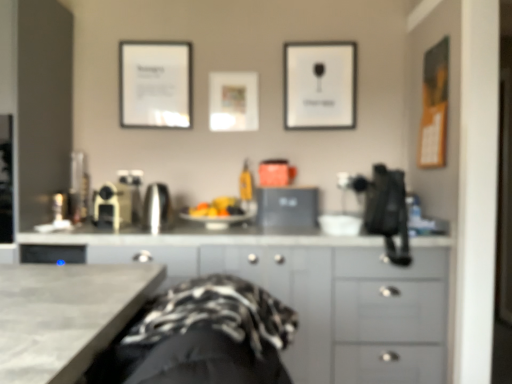
Question: Does matte white picture frame at center, marked as the 2th picture frame in a right-to-left arrangement, have a larger size compared to gray matte cabinet at center?

Choices:
 (A) yes
 (B) no

Answer: (B)

Question: Is matte white picture frame at center, which is the 2th picture frame from left to right, next to gray matte cabinet at center and touching it?

Choices:
 (A) no
 (B) yes

Answer: (A)

Question: Is matte white picture frame at center, which is the 2th picture frame from left to right, further to camera compared to gray matte cabinet at center?

Choices:
 (A) yes
 (B) no

Answer: (A)

Question: Is matte white picture frame at center, which is the 2th picture frame from left to right, to the right of gray matte cabinet at center from the viewer's perspective?

Choices:
 (A) yes
 (B) no

Answer: (B)

Question: Considering the relative sizes of matte white picture frame at center, which is the 2th picture frame from left to right, and gray matte cabinet at center in the image provided, is matte white picture frame at center, which is the 2th picture frame from left to right, shorter than gray matte cabinet at center?

Choices:
 (A) yes
 (B) no

Answer: (A)

Question: In terms of height, does white paper picture frame at upper center, the first picture frame from the right, look taller or shorter compared to white paper at upper left, marked as the third picture frame in a right-to-left arrangement?

Choices:
 (A) tall
 (B) short

Answer: (A)

Question: From a real-world perspective, is white paper picture frame at upper center, which appears as the 3th picture frame when viewed from the left, above or below white paper at upper left, which is the 1th picture frame in left-to-right order?

Choices:
 (A) above
 (B) below

Answer: (B)

Question: From the image's perspective, is white paper picture frame at upper center, the first picture frame from the right, above or below white paper at upper left, which is the 1th picture frame in left-to-right order?

Choices:
 (A) above
 (B) below

Answer: (B)

Question: Is point (284, 74) positioned closer to the camera than point (148, 99)?

Choices:
 (A) farther
 (B) closer

Answer: (B)

Question: Looking at their shapes, would you say satin black laptop at center, which appears as the third appliance when viewed from the left, is wider or thinner than white paper picture frame at upper center, the first picture frame from the right?

Choices:
 (A) thin
 (B) wide

Answer: (B)

Question: In the image, is satin black laptop at center, the first appliance in the right-to-left sequence, positioned in front of or behind white paper picture frame at upper center, the first picture frame from the right?

Choices:
 (A) front
 (B) behind

Answer: (A)

Question: Do you think satin black laptop at center, the first appliance in the right-to-left sequence, is within white paper picture frame at upper center, which appears as the 3th picture frame when viewed from the left, or outside of it?

Choices:
 (A) outside
 (B) inside

Answer: (A)

Question: From a real-world perspective, is satin black laptop at center, the first appliance in the right-to-left sequence, positioned above or below white paper picture frame at upper center, which appears as the 3th picture frame when viewed from the left?

Choices:
 (A) above
 (B) below

Answer: (B)

Question: In terms of width, does white paper picture frame at upper center, the first picture frame from the right, look wider or thinner when compared to matte white picture frame at center, which is the 2th picture frame from left to right?

Choices:
 (A) thin
 (B) wide

Answer: (A)

Question: Is white paper picture frame at upper center, which appears as the 3th picture frame when viewed from the left, in front of or behind matte white picture frame at center, which is the 2th picture frame from left to right, in the image?

Choices:
 (A) behind
 (B) front

Answer: (B)